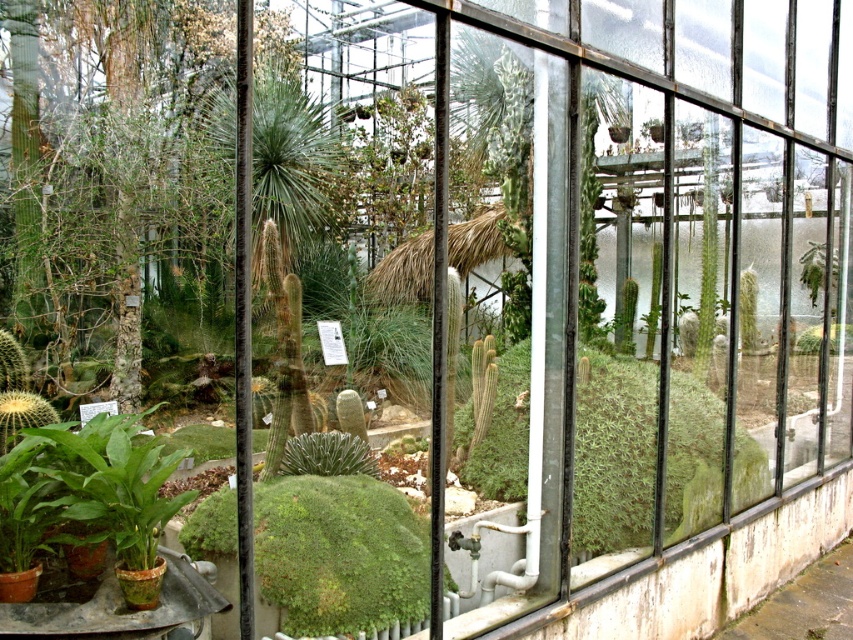
Looking at this image, you are a gardener who wants to place a new plant pot between the green fuzzy cactus at center and the green fuzzy cactus at right. The pot requires a space of 1.2 meters in width. Can the space between them accommodate this?

The green fuzzy cactus at center is wider than the green fuzzy cactus at right. Therefore, the space between them may vary depending on their exact placement, but since the question specifies the required space is 1.2 meters, we need to know the actual distance between them. However, the provided information only states the width of the cacti, not the distance between them. Thus, it cannot be determined from the given data.

You are a gardener in the greenhouse and want to place a new plant between the green fuzzy cactus at center and the green fuzzy cactus at right. Which cactus should you use as a reference for height to ensure the new plant is not taller than either?

The green fuzzy cactus at center is shorter than the green fuzzy cactus at right, so you should use the shorter green fuzzy cactus at center as the reference to ensure the new plant is not taller than either.

You are a gardener who wants to water the green fuzzy cactus at center and the green fuzzy cactus at right. Which cactus should you water first if you start from the entrance located at the bottom of the image?

You should water the green fuzzy cactus at center first because it is located below the green fuzzy cactus at right, making it closer to the entrance at the bottom of the image.